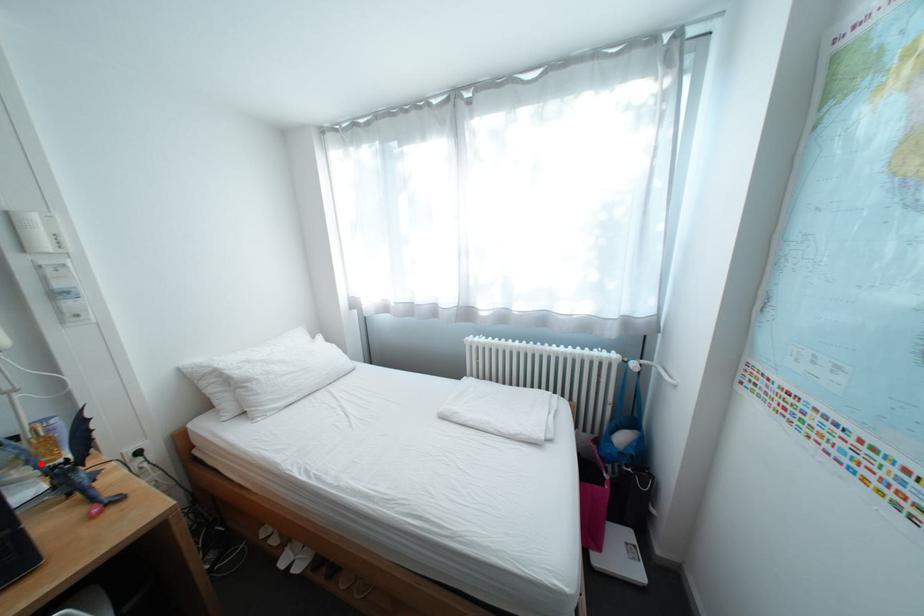
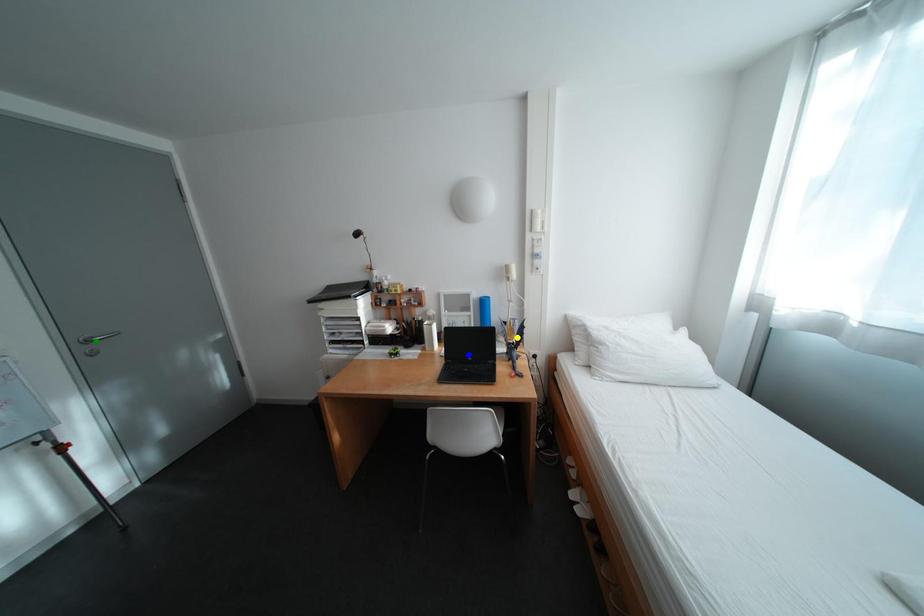
Question: I am providing you with two images of the same scene from different viewpoints. A red point is marked on the first image. You are given multiple points on the second image. Which spot in image 2 lines up with the point in image 1?

Choices:
 (A) blue point
 (B) yellow point
 (C) green point

Answer: (B)